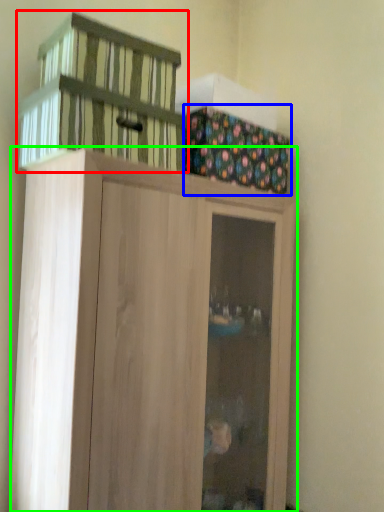
Question: Which object is the closest to the basket (highlighted by a red box)? Choose among these: cabinetry (highlighted by a blue box) or cupboard (highlighted by a green box).

Choices:
 (A) cabinetry
 (B) cupboard

Answer: (A)